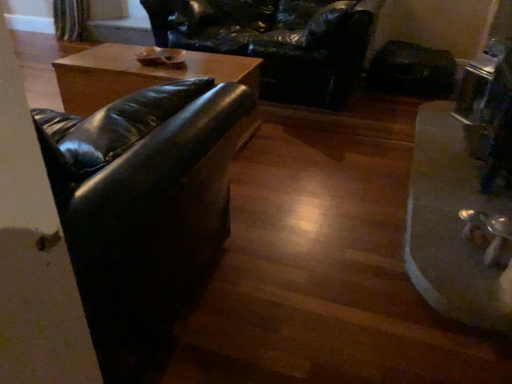
Question: Is the position of black leather couch at left more distant than that of metallic silver tray at lower right?

Choices:
 (A) no
 (B) yes

Answer: (A)

Question: Is black leather couch at left touching metallic silver tray at lower right?

Choices:
 (A) yes
 (B) no

Answer: (B)

Question: From the image's perspective, is black leather couch at left above metallic silver tray at lower right?

Choices:
 (A) yes
 (B) no

Answer: (B)

Question: Considering the relative positions of black leather couch at left and metallic silver tray at lower right in the image provided, is black leather couch at left to the right of metallic silver tray at lower right from the viewer's perspective?

Choices:
 (A) yes
 (B) no

Answer: (B)

Question: Is black leather couch at left in front of metallic silver tray at lower right?

Choices:
 (A) no
 (B) yes

Answer: (B)

Question: Does point (410, 211) appear closer or farther from the camera than point (93, 334)?

Choices:
 (A) farther
 (B) closer

Answer: (A)

Question: From the image's perspective, relative to black leather couch at left, is metallic silver tray at lower right above or below?

Choices:
 (A) above
 (B) below

Answer: (A)

Question: From a real-world perspective, relative to black leather couch at left, is metallic silver tray at lower right vertically above or below?

Choices:
 (A) above
 (B) below

Answer: (B)

Question: Is metallic silver tray at lower right in front of or behind black leather couch at left in the image?

Choices:
 (A) behind
 (B) front

Answer: (A)

Question: Considering the positions of point (321, 26) and point (145, 208), is point (321, 26) closer or farther from the camera than point (145, 208)?

Choices:
 (A) farther
 (B) closer

Answer: (A)

Question: Considering their positions, is black leather swivel chair at upper center located in front of or behind black leather couch at left?

Choices:
 (A) front
 (B) behind

Answer: (B)

Question: Looking at the image, does black leather swivel chair at upper center seem bigger or smaller compared to black leather couch at left?

Choices:
 (A) big
 (B) small

Answer: (A)

Question: From their relative heights in the image, would you say black leather swivel chair at upper center is taller or shorter than black leather couch at left?

Choices:
 (A) tall
 (B) short

Answer: (B)

Question: Considering their positions, is metallic silver tray at lower right located in front of or behind black leather swivel chair at upper center?

Choices:
 (A) behind
 (B) front

Answer: (B)

Question: Looking at the image, does metallic silver tray at lower right seem bigger or smaller compared to black leather swivel chair at upper center?

Choices:
 (A) small
 (B) big

Answer: (A)